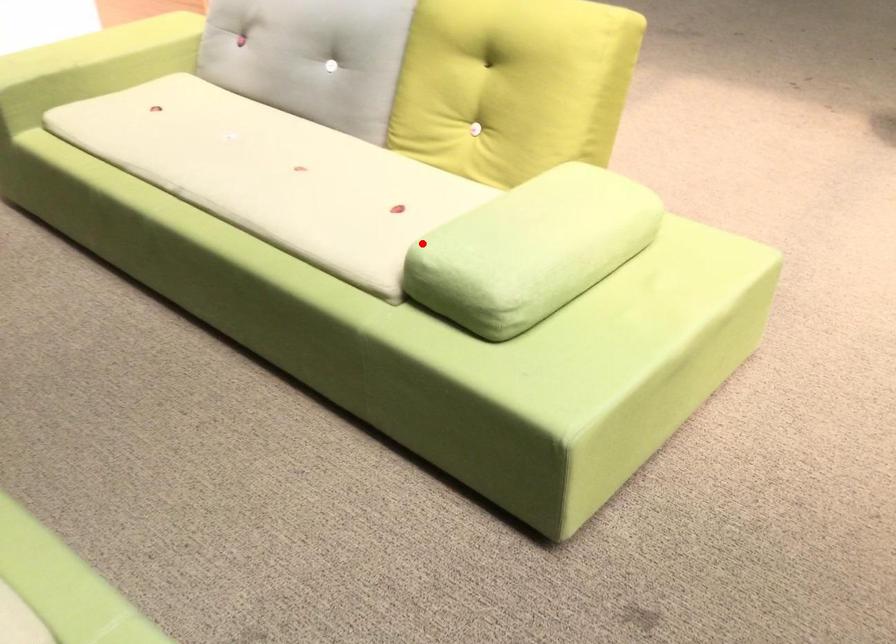
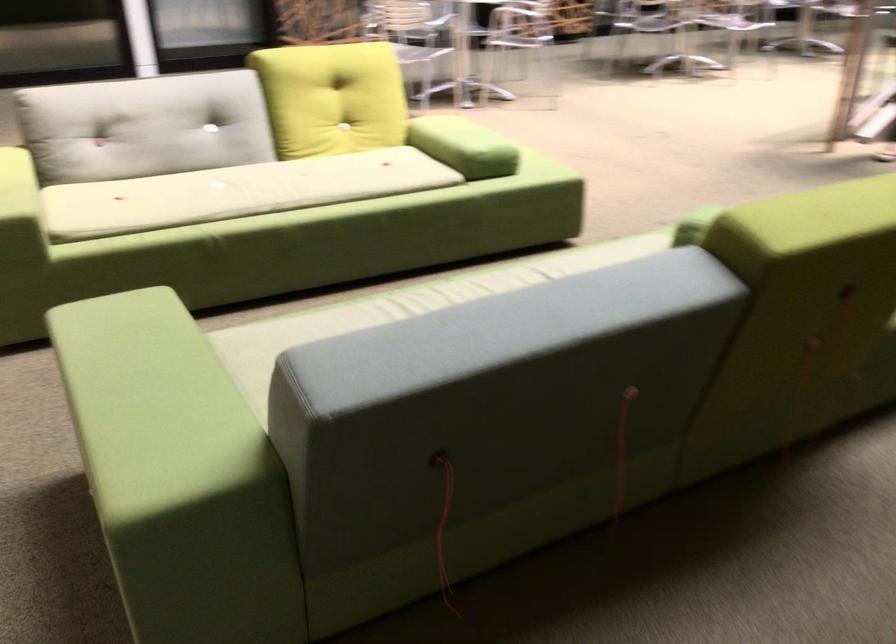
Question: I am providing you with two images of the same scene from different viewpoints. Given a red point in image1, look at the same physical point in image2. Is it:

Choices:
 (A) Closer to the viewpoint
 (B) Farther from the viewpoint

Answer: (B)